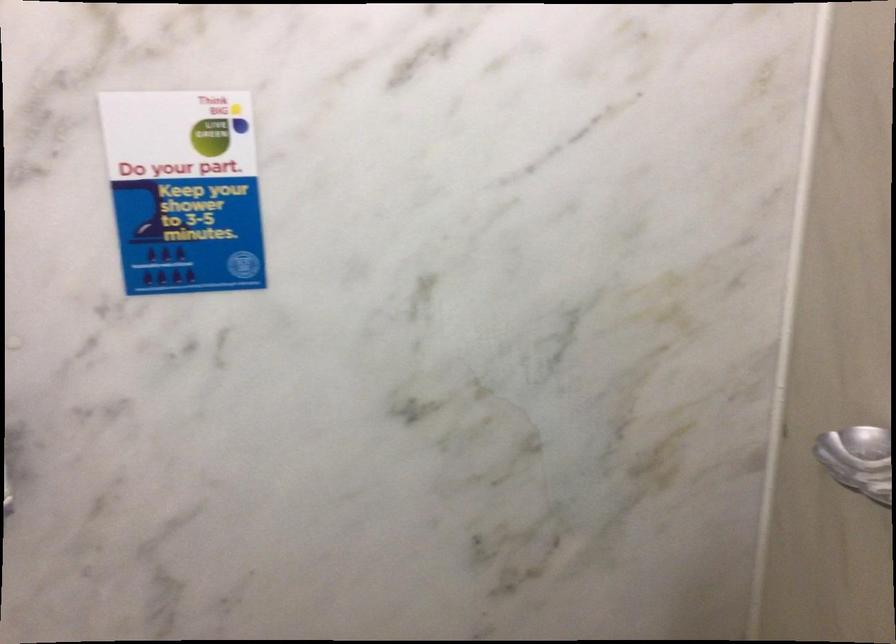
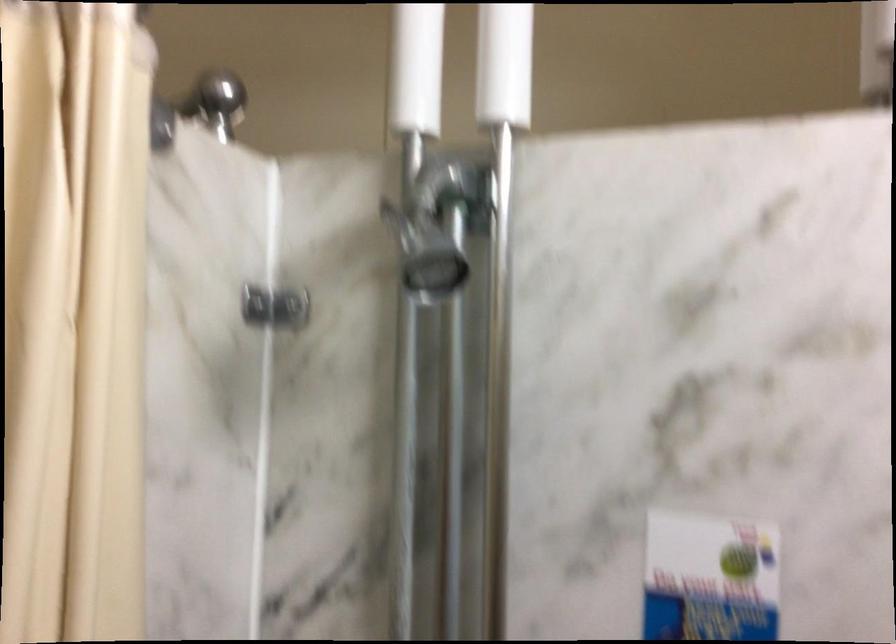
Question: In a continuous first-person perspective shot, in which direction is the camera moving?

Choices:
 (A) Left
 (B) Right
 (C) Forward
 (D) Backward

Answer: (D)